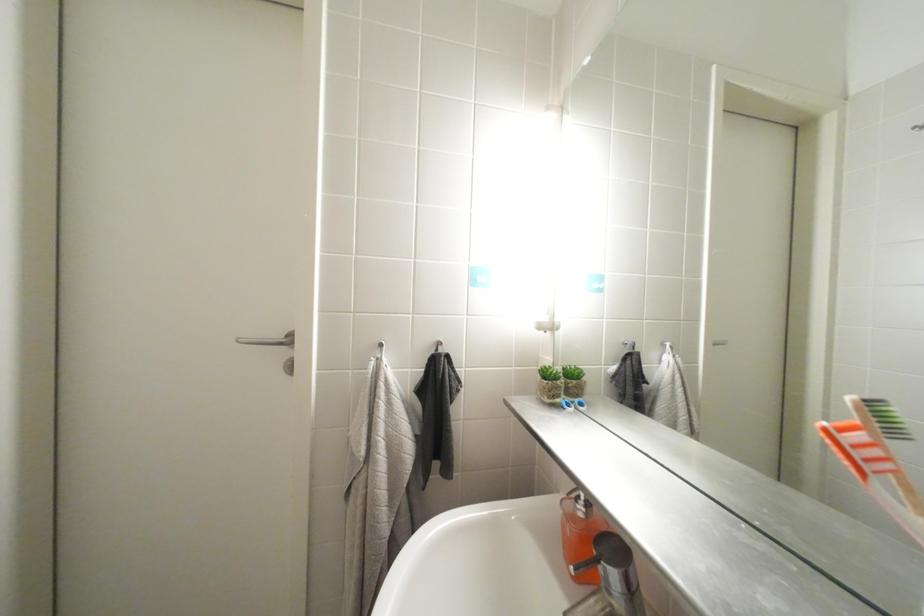
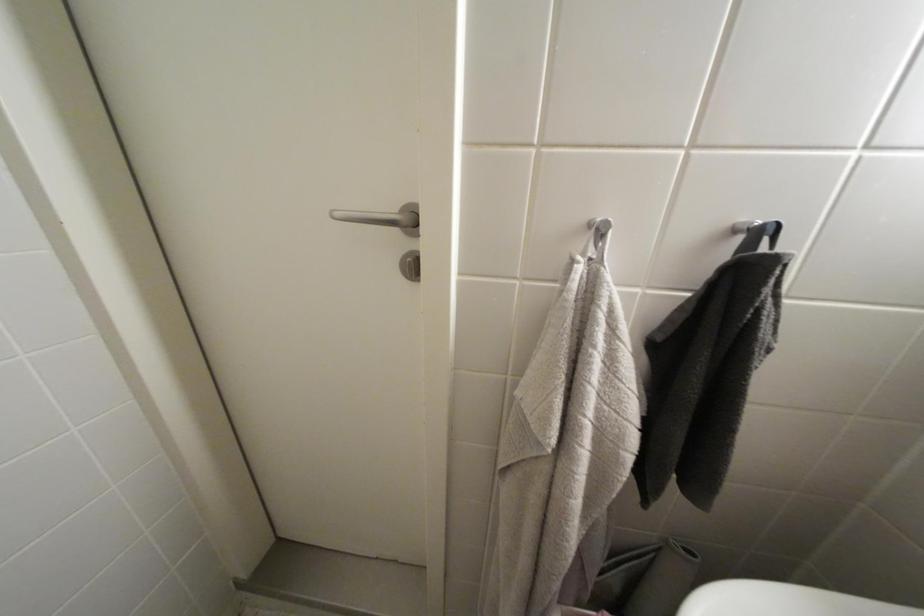
First-person continuous shooting, in which direction is the camera rotating?

The camera rotated toward left-down.